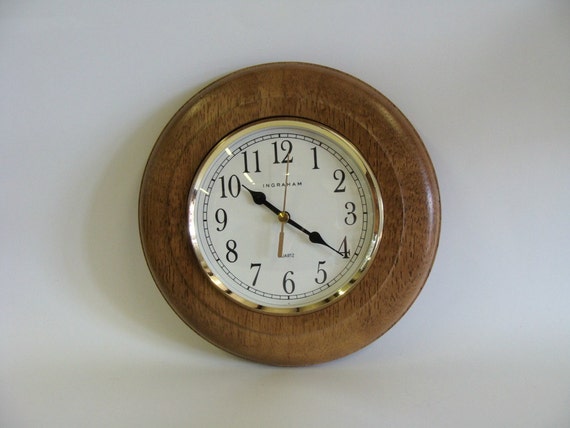
The height and width of the screenshot is (428, 570). What are the coordinates of `gold circle around clock` in the screenshot? It's located at (378, 204), (377, 236).